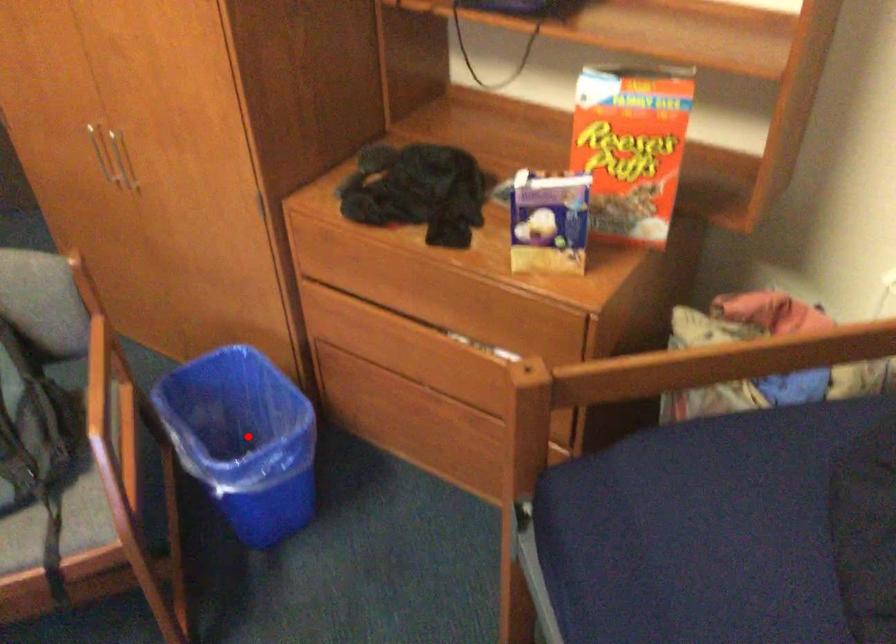
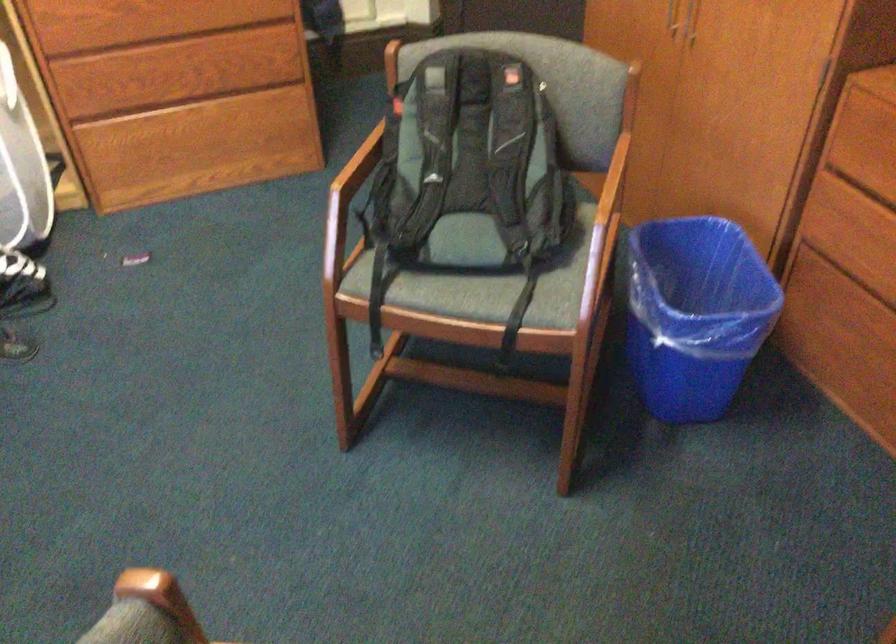
Find the pixel in the second image that matches the highlighted location in the first image.

(694, 313)